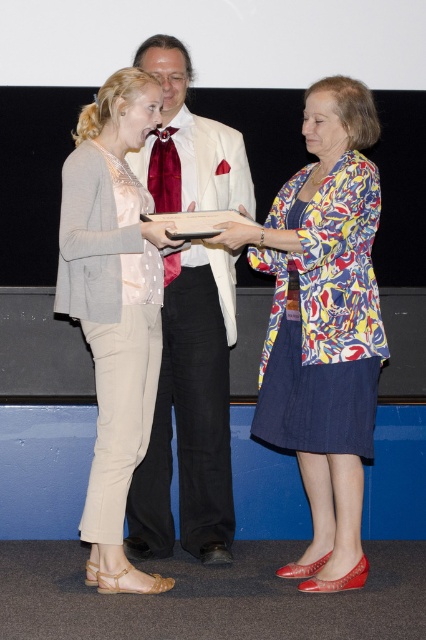
Question: Among these points, which one is farthest from the camera?

Choices:
 (A) (193, 353)
 (B) (347, 180)

Answer: (A)

Question: Can you confirm if matte white suit at center is bigger than beige cotton pants at left?

Choices:
 (A) no
 (B) yes

Answer: (A)

Question: Can you confirm if matte white suit at center is positioned to the right of beige cotton pants at left?

Choices:
 (A) yes
 (B) no

Answer: (A)

Question: Where is matte white suit at center located in relation to shiny red silk tie at center in the image?

Choices:
 (A) left
 (B) right

Answer: (B)

Question: Based on their relative distances, which object is nearer to the shiny red silk tie at center?

Choices:
 (A) printed fabric jacket at center
 (B) matte white suit at center

Answer: (B)

Question: Which point is farther to the camera?

Choices:
 (A) (262, 369)
 (B) (92, 323)
 (C) (222, 524)
 (D) (176, 182)

Answer: (C)